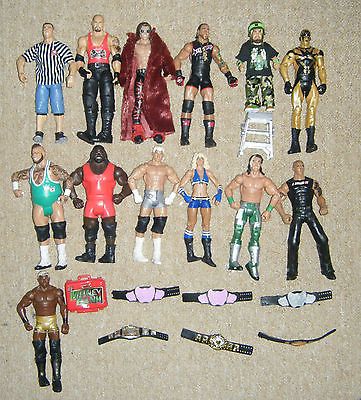
Locate an element on the screen. Image resolution: width=361 pixels, height=400 pixels. toys with red elements is located at coordinates (93, 54), (139, 53), (200, 56), (98, 177), (85, 296).